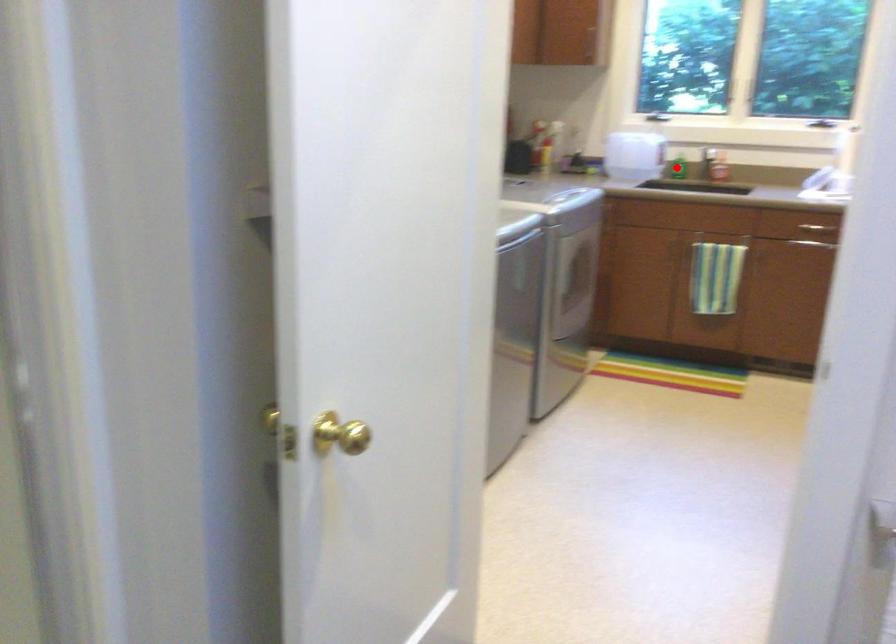
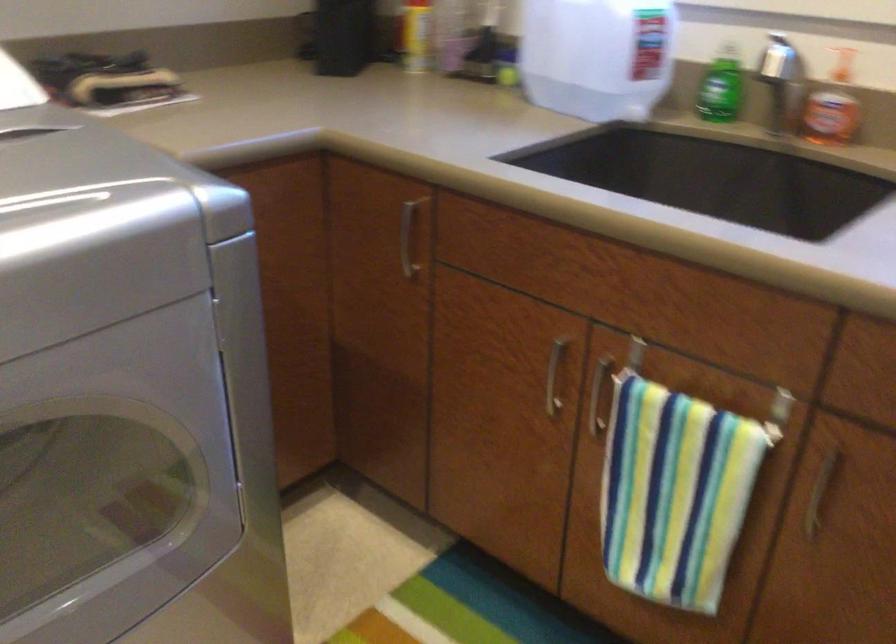
Where in the second image is the point corresponding to the highlighted location from the first image?

(718, 105)